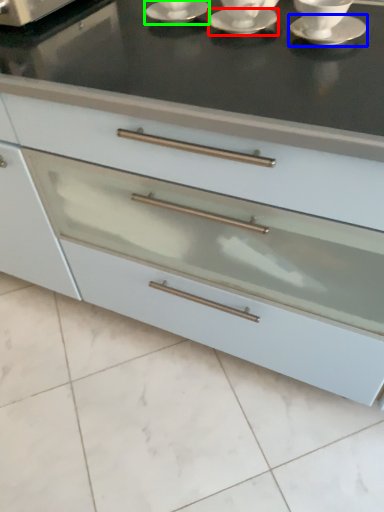
Question: Estimate the real-world distances between objects in this image. Which object is closer to saucer (highlighted by a red box), saucer (highlighted by a blue box) or saucer (highlighted by a green box)?

Choices:
 (A) saucer
 (B) saucer

Answer: (B)